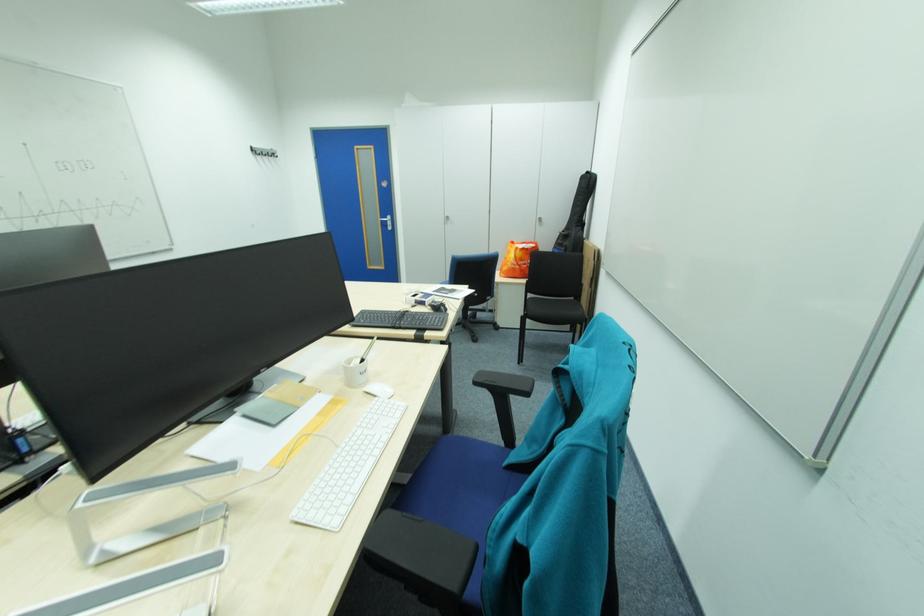
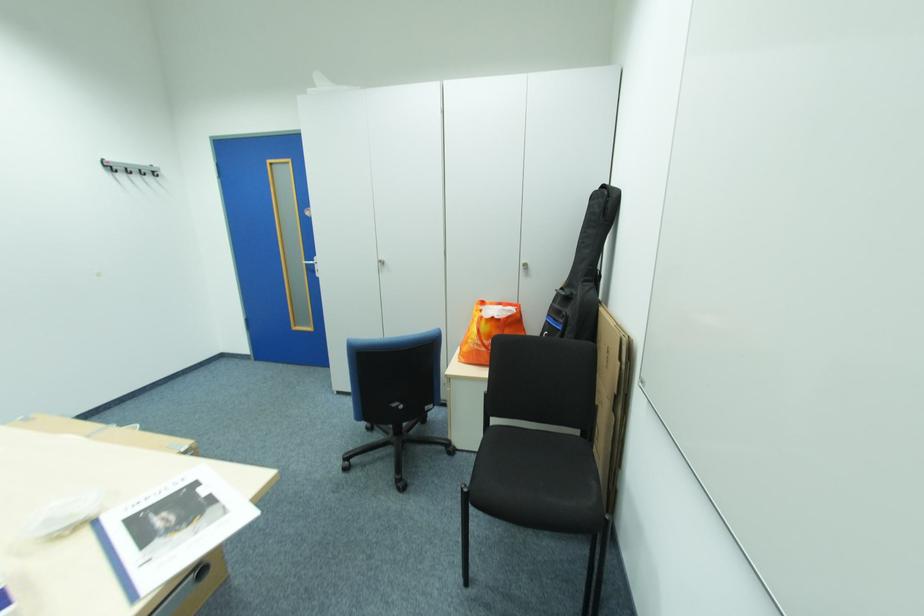
In the second image, find the point that corresponds to (516,330) in the first image.

(478, 455)